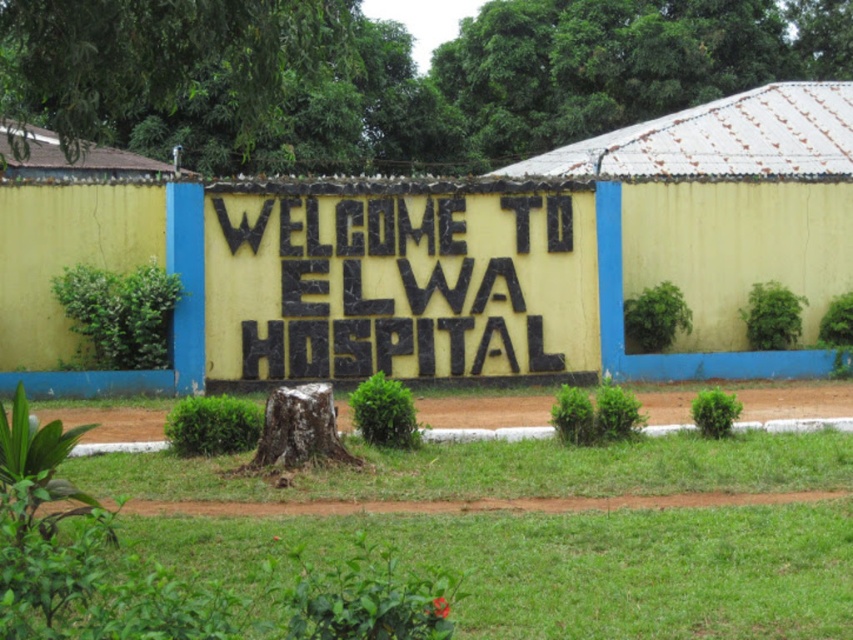
Question: Is blackmaterial/texture sign at center smaller than brown rough tree stump at center?

Choices:
 (A) yes
 (B) no

Answer: (B)

Question: Does blackmaterial/texture sign at center have a smaller size compared to brown rough tree stump at center?

Choices:
 (A) yes
 (B) no

Answer: (B)

Question: Which of the following is the farthest from the observer?

Choices:
 (A) blackmaterial/texture sign at center
 (B) brown rough tree stump at center

Answer: (A)

Question: Considering the relative positions of blackmaterial/texture sign at center and brown rough tree stump at center in the image provided, where is blackmaterial/texture sign at center located with respect to brown rough tree stump at center?

Choices:
 (A) right
 (B) left

Answer: (A)

Question: Among these points, which one is farthest from the camera?

Choices:
 (A) (537, 218)
 (B) (312, 403)

Answer: (A)